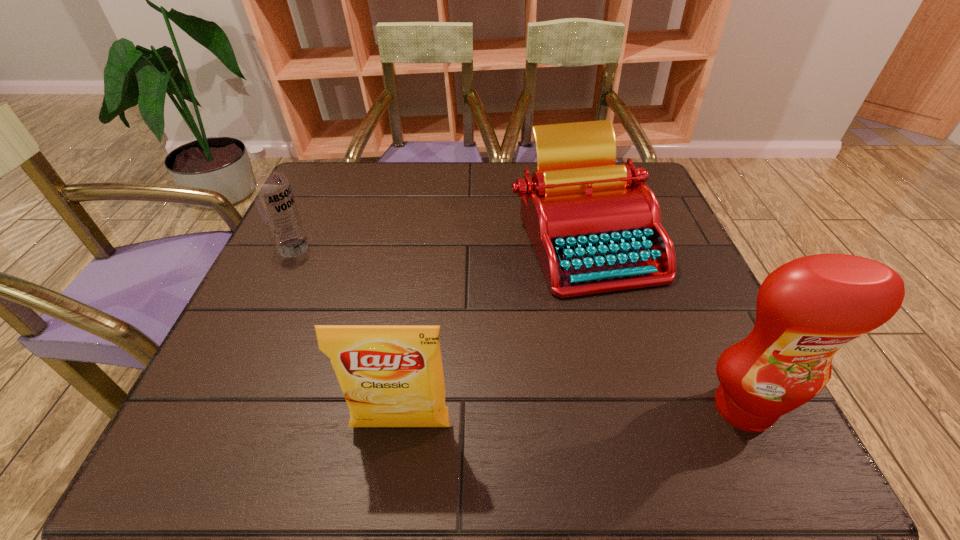
Locate an element on the screen. This screenshot has width=960, height=540. object positioned at the far edge is located at coordinates pyautogui.click(x=595, y=227).

I want to click on crisp (potato chip) positioned at the near edge, so click(391, 375).

Image resolution: width=960 pixels, height=540 pixels. Find the location of `condiment that is at the near edge`. condiment that is at the near edge is located at coordinates (807, 309).

The height and width of the screenshot is (540, 960). In order to click on object positioned at the left edge in this screenshot , I will do `click(270, 188)`.

Identify the location of condiment positioned at the right edge. The width and height of the screenshot is (960, 540). (807, 309).

The image size is (960, 540). In order to click on typewriter located in the right edge section of the desktop in this screenshot , I will do `click(595, 227)`.

The width and height of the screenshot is (960, 540). Identify the location of object present at the far right corner. (595, 227).

Image resolution: width=960 pixels, height=540 pixels. In order to click on object present at the near right corner in this screenshot , I will do `click(807, 309)`.

At what (x,y) coordinates should I click in order to perform the action: click on vacant space at the far edge of the desktop. Please return your answer as a coordinate pair (x, y). The height and width of the screenshot is (540, 960). Looking at the image, I should click on (474, 165).

Identify the location of vacant area at the near edge of the desktop. (318, 388).